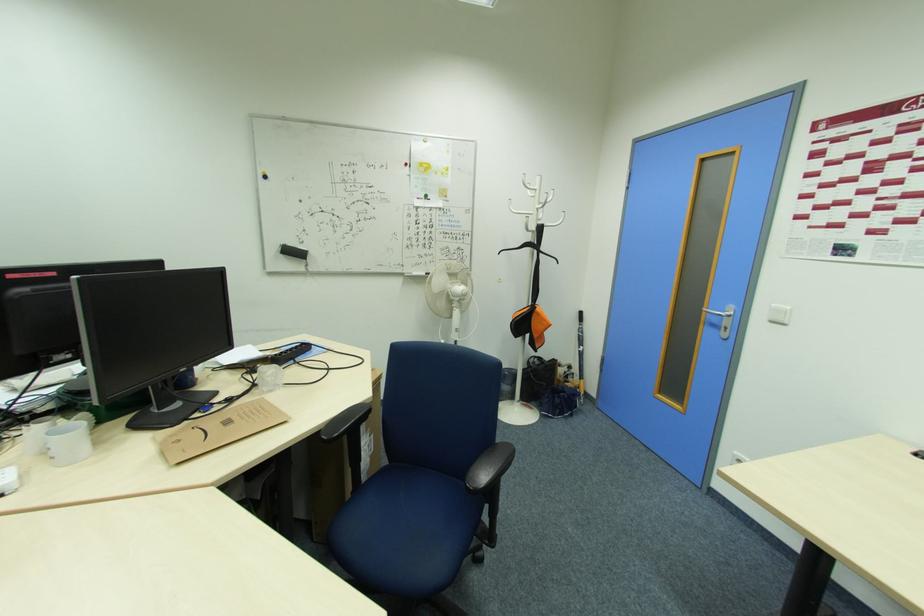
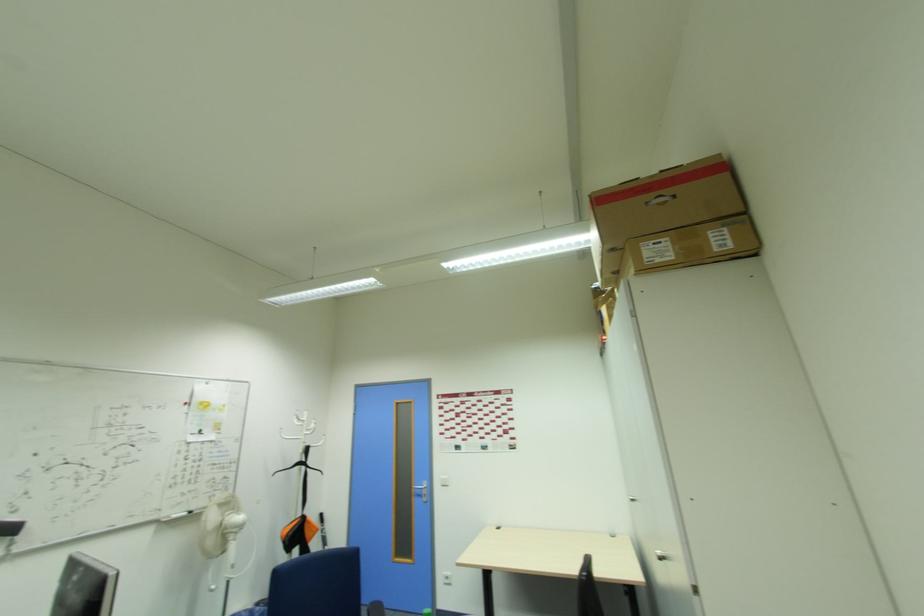
The point at (721, 310) is marked in the first image. Where is the corresponding point in the second image?

(421, 485)